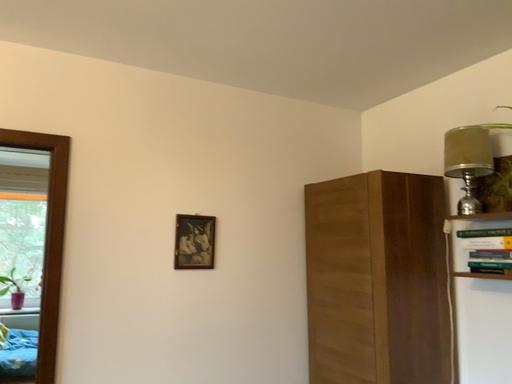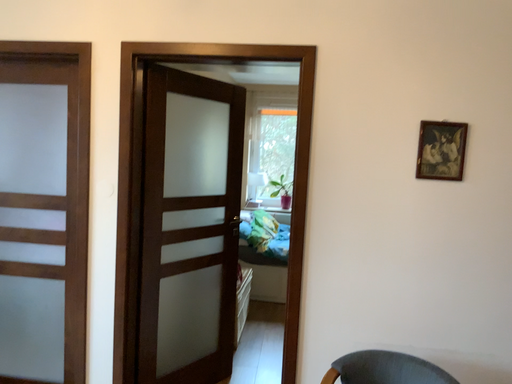
Question: Which way did the camera rotate in the video?

Choices:
 (A) rotated right
 (B) rotated left

Answer: (B)